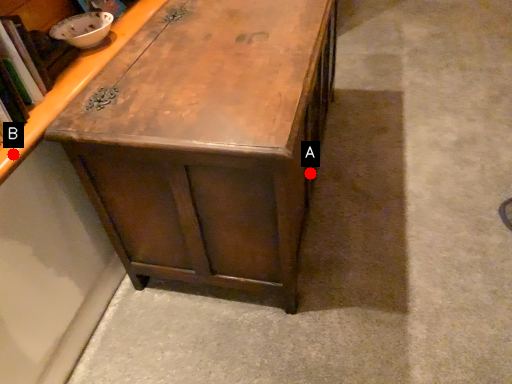
Question: Two points are circled on the image, labeled by A and B beside each circle. Which point is closer to the camera?

Choices:
 (A) A is closer
 (B) B is closer

Answer: (B)